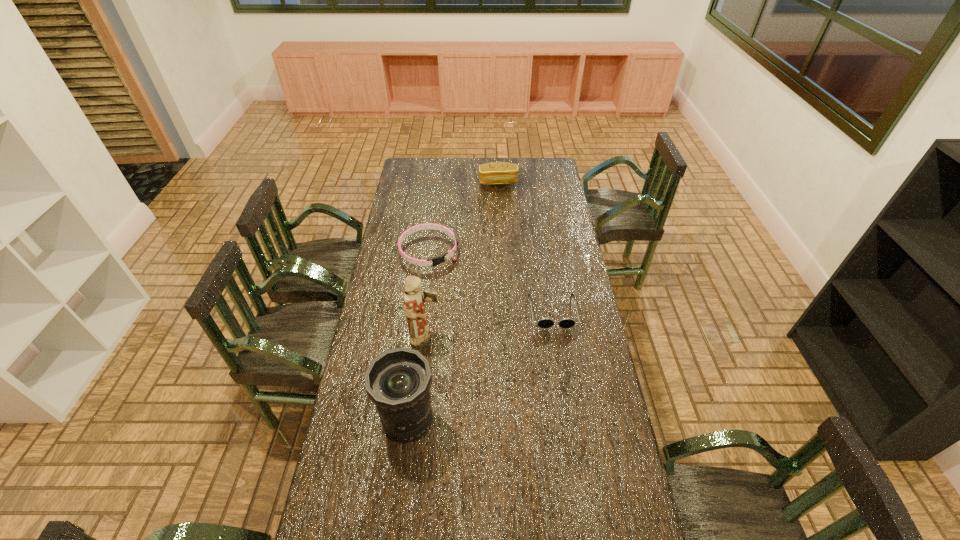
At what (x,y) coordinates should I click in order to perform the action: click on the second tallest object. Please return your answer as a coordinate pair (x, y). Looking at the image, I should click on [398, 381].

Where is `telephoto lens`? Image resolution: width=960 pixels, height=540 pixels. telephoto lens is located at coordinates (398, 381).

In order to click on sunglasses in this screenshot , I will do `click(544, 322)`.

At what (x,y) coordinates should I click in order to perform the action: click on the farthest object. Please return your answer as a coordinate pair (x, y). The width and height of the screenshot is (960, 540). Looking at the image, I should click on (496, 173).

Find the location of a particular element. The height and width of the screenshot is (540, 960). the third tallest object is located at coordinates (496, 173).

This screenshot has height=540, width=960. What are the coordinates of `figurine` in the screenshot? It's located at (414, 306).

Identify the location of dog collar. Image resolution: width=960 pixels, height=540 pixels. (438, 260).

Identify the location of free space located 0.200m on the right of the telephoto lens. The width and height of the screenshot is (960, 540). (497, 421).

Locate an element on the screen. The image size is (960, 540). free region located 0.050m on the front-facing side of the sunglasses is located at coordinates (557, 340).

Locate an element on the screen. This screenshot has height=540, width=960. free location located 0.340m on the zipper side of the third shortest object is located at coordinates (501, 227).